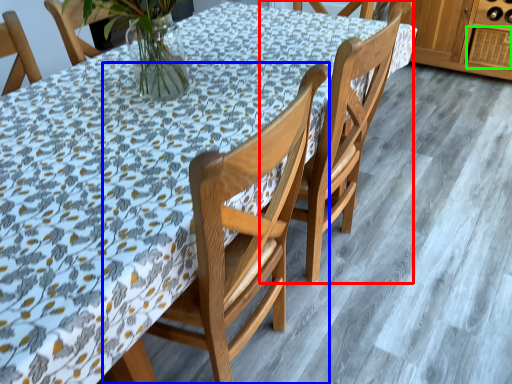
Question: Based on their relative distances, which object is farther from chair (highlighted by a red box)? Choose from chair (highlighted by a blue box) and drawer (highlighted by a green box).

Choices:
 (A) chair
 (B) drawer

Answer: (B)